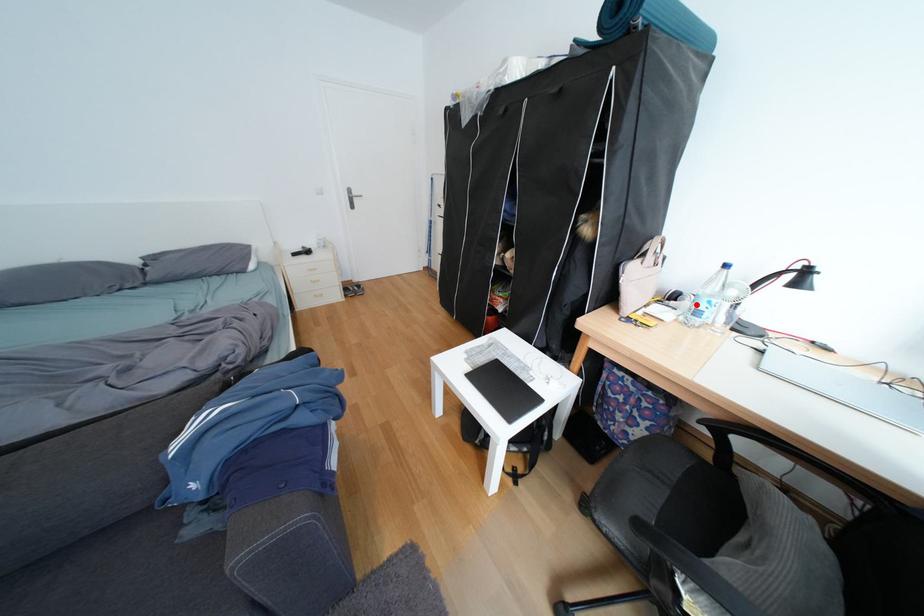
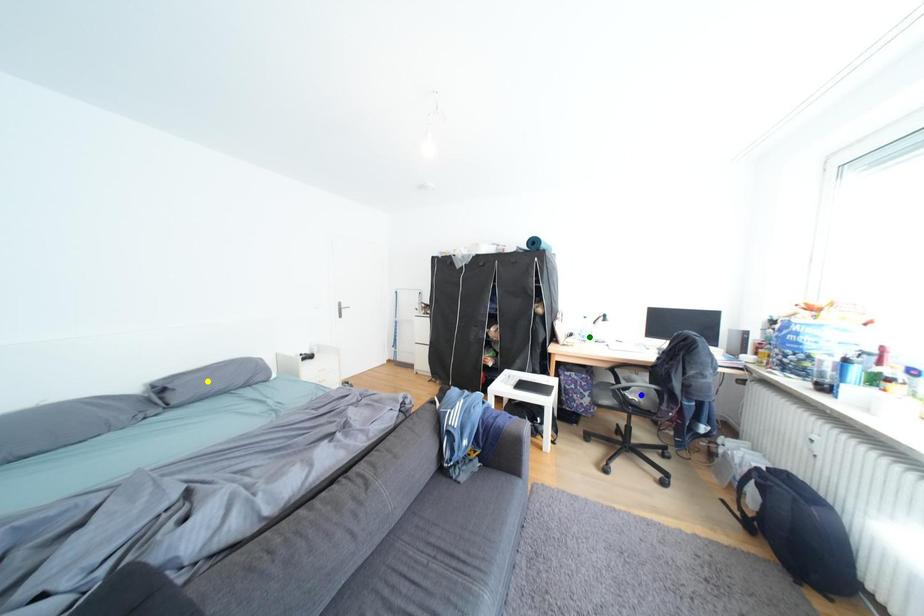
Question: I am providing you with two images of the same scene from different viewpoints. A red point is marked on the first image. You are given multiple points on the second image. Can you choose the point in image 2 that corresponds to the point in image 1?

Choices:
 (A) blue point
 (B) green point
 (C) yellow point

Answer: (B)